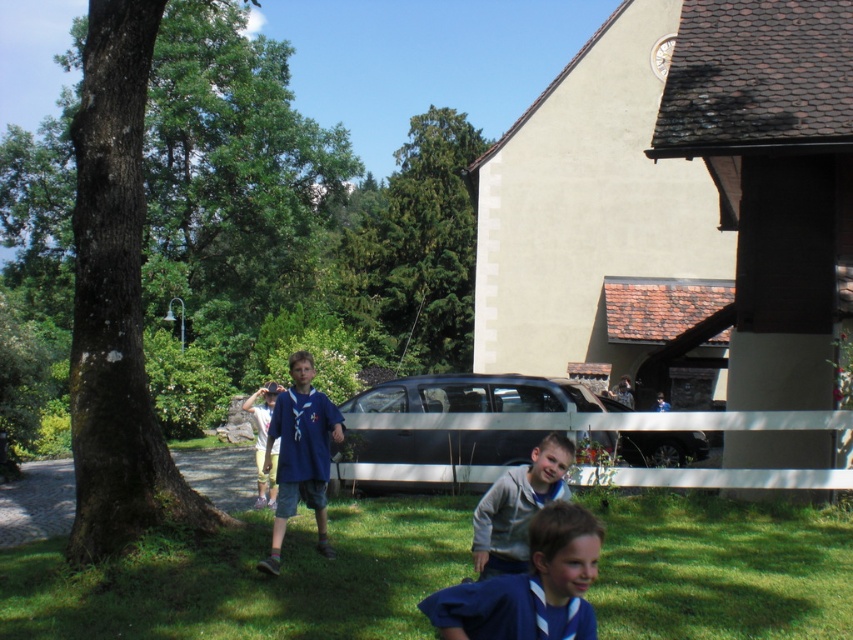
You are a photographer trying to capture a photo of the blue cotton shirt at center. Since the green rough bark tree at left is blocking your view, can you move to the right to get a clear shot?

The green rough bark tree at left is larger in size than the blue cotton shirt at center, so moving to the right might not help because the tree is bigger and could still block the view.

You are a photographer trying to capture a photo of the two boys wearing blue shirts. The blue fabric shirt at lower center and the blue cotton shirt at center are both in the scene. Which boy should you focus on first if you want to photograph them from the lowest possible angle?

You should focus on the blue cotton shirt at center first because it is located lower than the blue fabric shirt at lower center, requiring a lower angle to capture.

You are a photographer trying to capture a photo of the blue fabric shirt at lower center without the green rough bark tree at left blocking it. Based on their sizes, can you suggest a way to adjust your position to achieve this?

The green rough bark tree at left is much taller than the blue fabric shirt at lower center. To avoid the tree blocking the shirt, you can lower your camera angle or move closer to the shirt so that the tree appears smaller in the frame relative to the shirt.